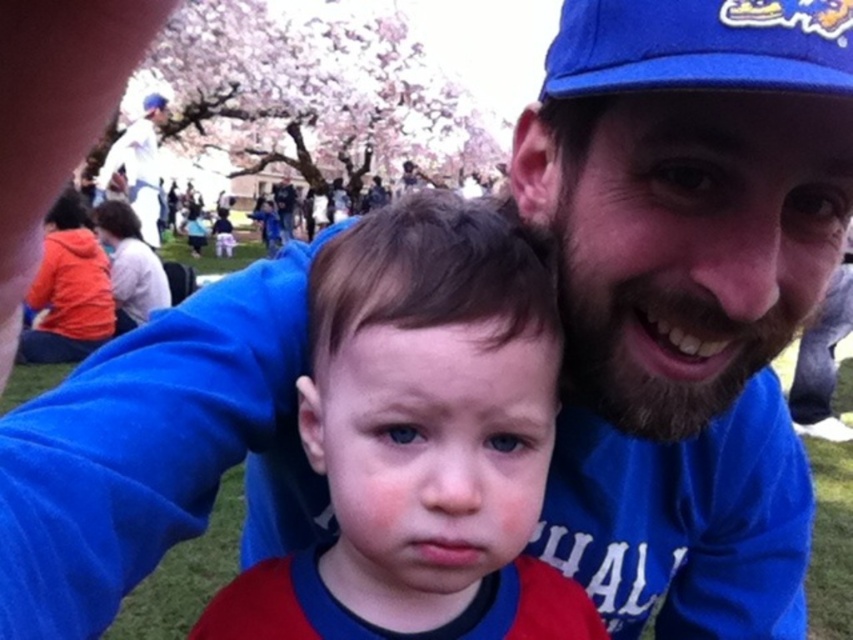
You are a photographer trying to focus on the smooth red shirt at center. What is the exact coordinate where you should aim your camera?

The smooth red shirt at center is located at point (422, 440), so you should aim your camera at those coordinates to focus on it.

You are standing at the position of point (811,1) and want to walk to the position of point (469,422). Is there a clear path between these two points without going through any objects?

Point (469,422) is behind point (811,1), so there might be an obstruction between them. You should check for any objects blocking the path before proceeding.